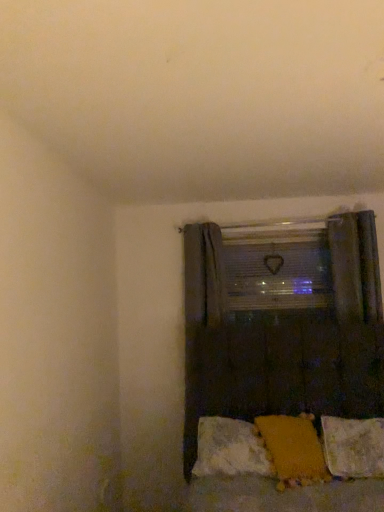
Question: From the image's perspective, is fluffy white pillow at lower right, which is the first pillow in right-to-left order, located beneath orange fabric pillow at lower center, the third pillow from the right?

Choices:
 (A) yes
 (B) no

Answer: (A)

Question: From a real-world perspective, does fluffy white pillow at lower right, which is the first pillow in right-to-left order, stand above orange fabric pillow at lower center, which is counted as the first pillow, starting from the left?

Choices:
 (A) no
 (B) yes

Answer: (A)

Question: Does fluffy white pillow at lower right, the 3th pillow when ordered from left to right, have a greater height compared to orange fabric pillow at lower center, which is counted as the first pillow, starting from the left?

Choices:
 (A) no
 (B) yes

Answer: (B)

Question: Is the position of fluffy white pillow at lower right, which is the first pillow in right-to-left order, more distant than that of orange fabric pillow at lower center, the third pillow from the right?

Choices:
 (A) no
 (B) yes

Answer: (A)

Question: From the image's perspective, does fluffy white pillow at lower right, which is the first pillow in right-to-left order, appear higher than orange fabric pillow at lower center, the third pillow from the right?

Choices:
 (A) yes
 (B) no

Answer: (B)

Question: From their relative heights in the image, would you say fluffy white pillow at lower right, which is the first pillow in right-to-left order, is taller or shorter than orange fabric pillow at lower center, which is counted as the first pillow, starting from the left?

Choices:
 (A) tall
 (B) short

Answer: (A)

Question: Considering the positions of fluffy white pillow at lower right, which is the first pillow in right-to-left order, and orange fabric pillow at lower center, which is counted as the first pillow, starting from the left, in the image, is fluffy white pillow at lower right, which is the first pillow in right-to-left order, bigger or smaller than orange fabric pillow at lower center, which is counted as the first pillow, starting from the left,?

Choices:
 (A) big
 (B) small

Answer: (B)

Question: Is point (347, 472) positioned closer to the camera than point (211, 439)?

Choices:
 (A) farther
 (B) closer

Answer: (B)

Question: Considering their positions, is fluffy white pillow at lower right, the 3th pillow when ordered from left to right, located in front of or behind orange fabric pillow at lower center, the third pillow from the right?

Choices:
 (A) behind
 (B) front

Answer: (B)

Question: From the image's perspective, is clear plastic window screen at center positioned above or below yellow fabric pillow at lower center, which ranks as the 2th pillow in left-to-right order?

Choices:
 (A) above
 (B) below

Answer: (A)

Question: From a real-world perspective, is clear plastic window screen at center positioned above or below yellow fabric pillow at lower center, positioned as the second pillow in right-to-left order?

Choices:
 (A) above
 (B) below

Answer: (A)

Question: Would you say clear plastic window screen at center is inside or outside yellow fabric pillow at lower center, which ranks as the 2th pillow in left-to-right order?

Choices:
 (A) outside
 (B) inside

Answer: (A)

Question: Is clear plastic window screen at center taller or shorter than yellow fabric pillow at lower center, which ranks as the 2th pillow in left-to-right order?

Choices:
 (A) tall
 (B) short

Answer: (A)

Question: From a real-world perspective, is clear plastic window screen at center positioned above or below fluffy white pillow at lower right, which is the first pillow in right-to-left order?

Choices:
 (A) below
 (B) above

Answer: (B)

Question: Considering their positions, is clear plastic window screen at center located in front of or behind fluffy white pillow at lower right, the 3th pillow when ordered from left to right?

Choices:
 (A) front
 (B) behind

Answer: (B)